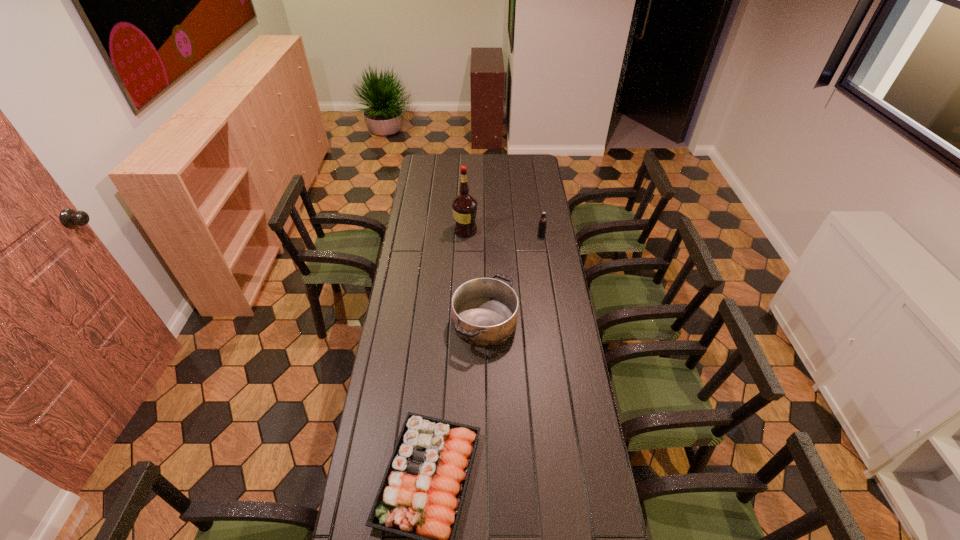
The image size is (960, 540). What are the coordinates of `blank space that satisfies the following two spatial constraints: 1. on the back side of the third farthest object; 2. on the label of the alcohol` in the screenshot? It's located at (484, 231).